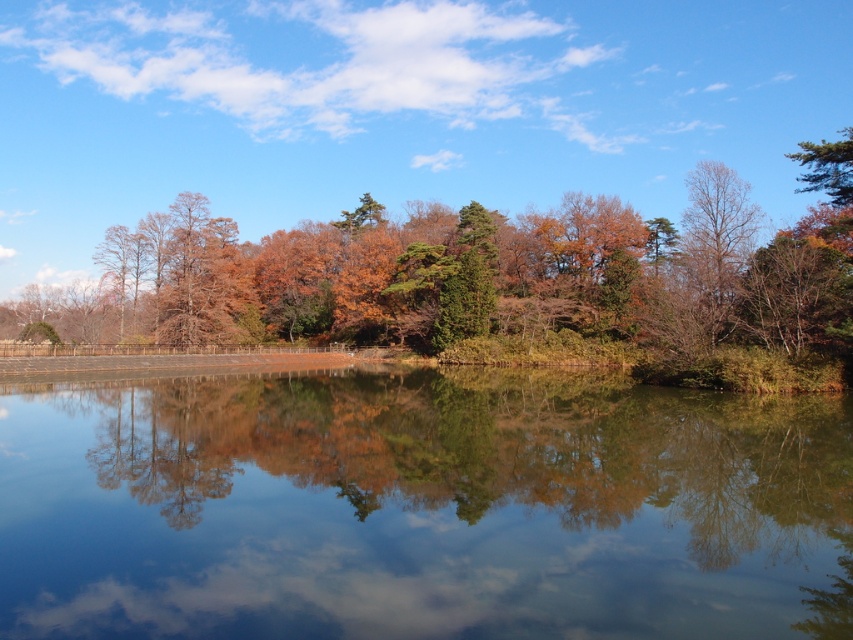
In the scene shown: You are standing at the edge of the water in the serene landscape scene. You notice two points marked in the image. Which point is closer to you, point (138, 320) or point (195, 321)?

Point (138, 320) is further to the viewer than point (195, 321), so point (195, 321) is closer to you.

You are standing on a wooden dock and see the green reflective water at center and the green matte tree at center. Which object is located to the right of the other?

The green reflective water at center is positioned on the left side of green matte tree at center, so the green matte tree at center is to the right of the green reflective water at center.

In the scene shown: You are an artist planning to paint the landscape. You have two trees in your viewfinder, the green matte tree at center and the brown matte tree at upper left. Which tree should you paint larger to maintain the correct perspective?

You should paint the green matte tree at center larger than the brown matte tree at upper left because it is bigger in the scene.